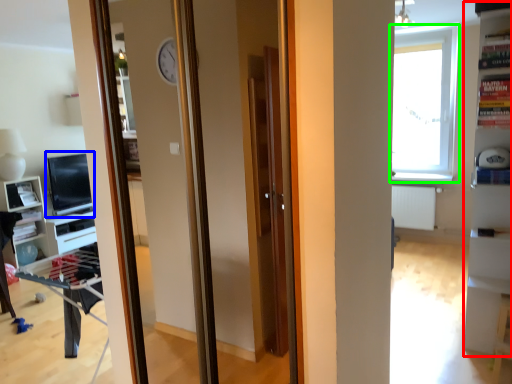
Question: Considering the real-world distances, which object is farthest from bookshelf (highlighted by a red box)? computer monitor (highlighted by a blue box) or window (highlighted by a green box)?

Choices:
 (A) computer monitor
 (B) window

Answer: (A)